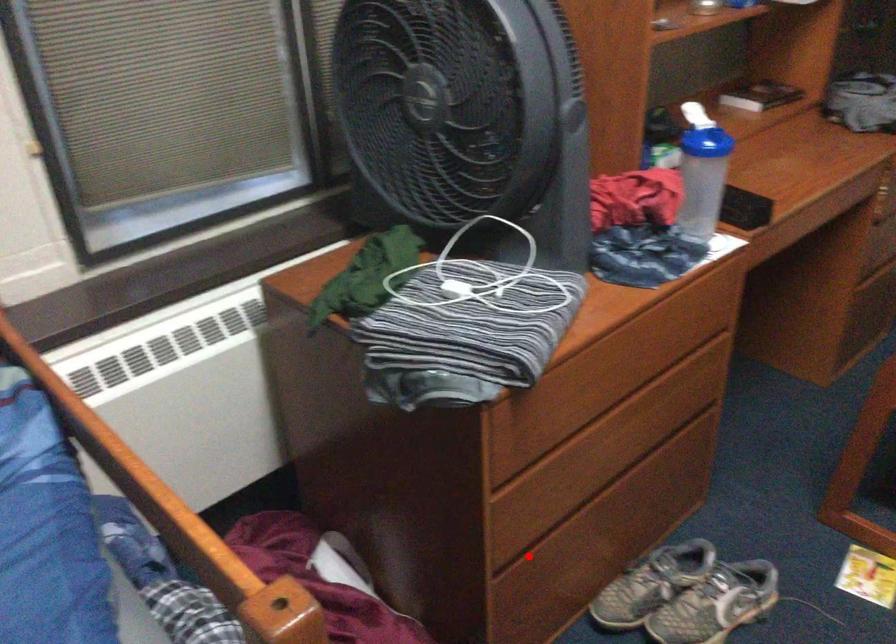
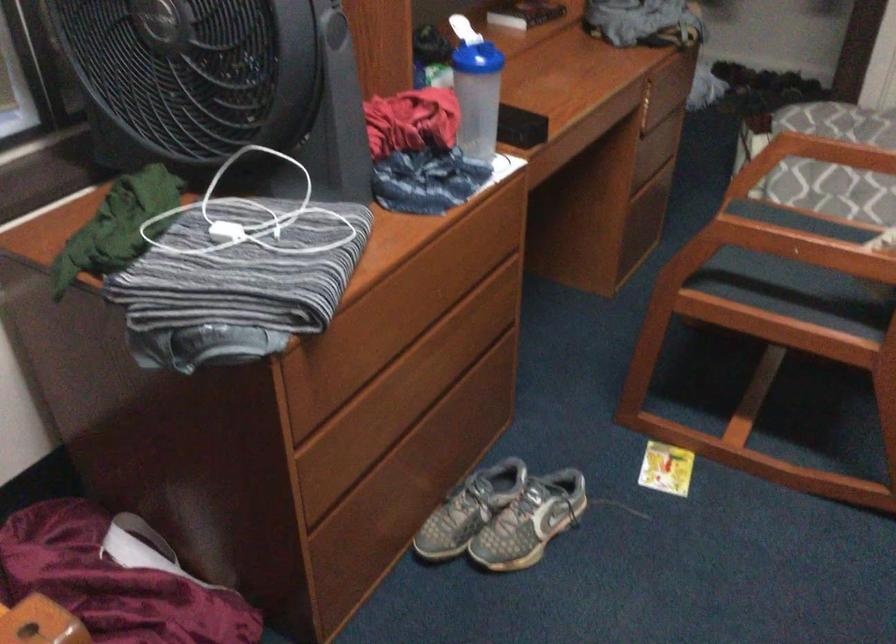
The point at the highlighted location is marked in the first image. Where is the corresponding point in the second image?

(343, 506)